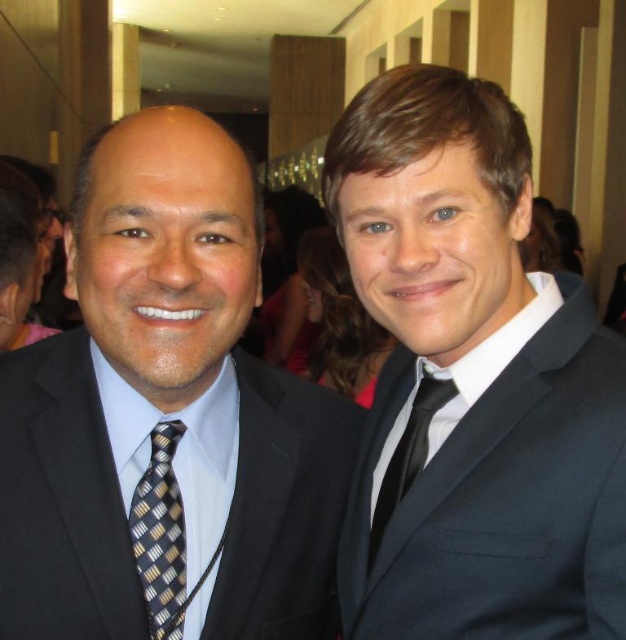
Where is the black silk suit at left located in the image?

The black silk suit at left is located at point 0.652 on the x axis and 0.267 on the y axis.

You are a tailor observing two men in suits. You notice the point at coordinates (471, 384) on the image. Which man is wearing the matte black suit at right?

The point at coordinates (471, 384) indicates the matte black suit at right, so the man on the right is wearing the matte black suit at right.